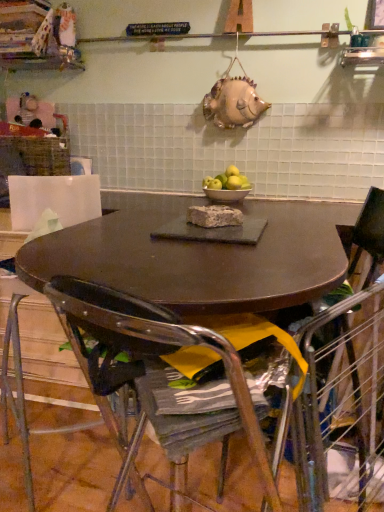
Find the location of `vacant area that lies to the right of brown crumbly cake at center`. vacant area that lies to the right of brown crumbly cake at center is located at coordinates (289, 230).